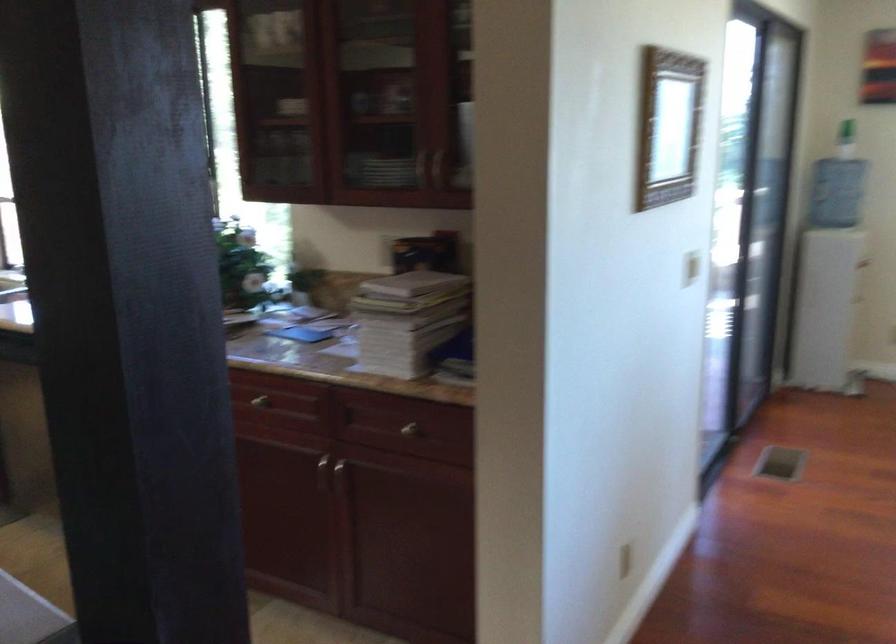
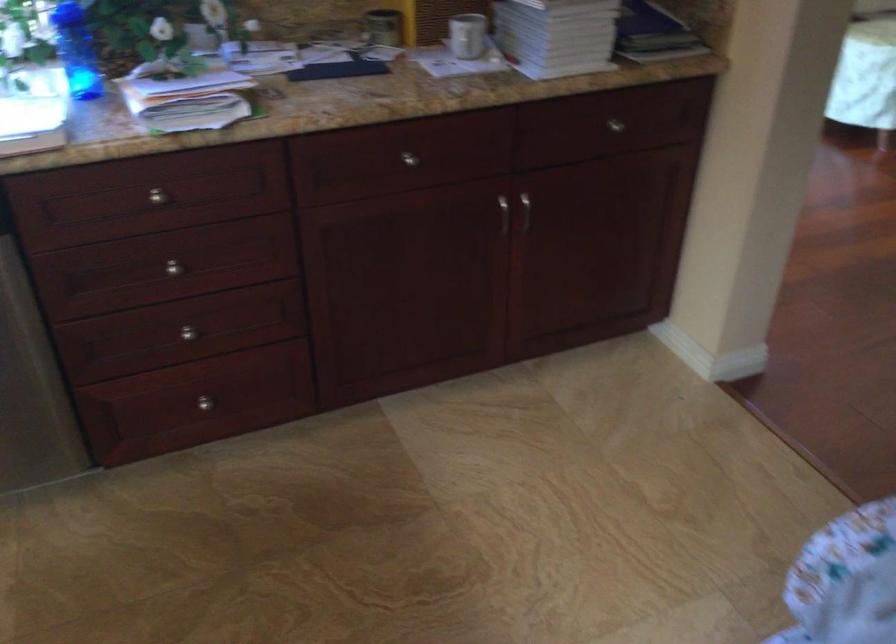
Locate, in the second image, the point that corresponds to (407,431) in the first image.

(615, 125)